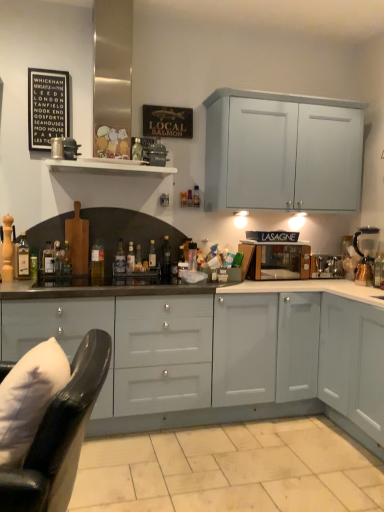
In order to click on vacant area in front of translucent glass bottle at center, which appears as the 9th bottle when viewed from the right in this screenshot , I will do `click(34, 281)`.